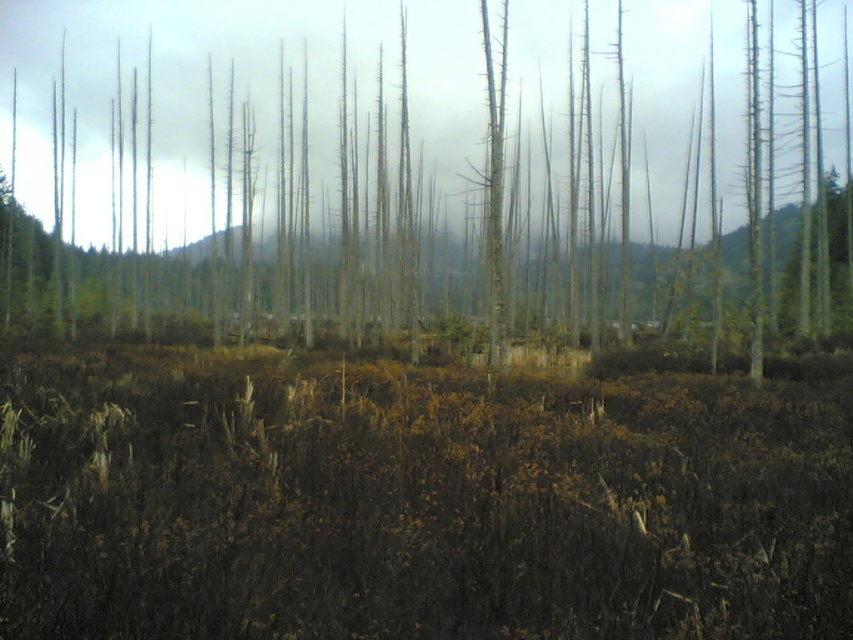
In the scene shown: Does brown dry grass at center come behind smooth gray tree trunk at center?

No.

Does brown dry grass at center have a smaller size compared to smooth gray tree trunk at center?

Correct, brown dry grass at center occupies less space than smooth gray tree trunk at center.

Between point (587, 515) and point (183, 3), which one is positioned in front?

Positioned in front is point (587, 515).

At what (x,y) coordinates should I click in order to perform the action: click on brown dry grass at center. Please return your answer as a coordinate pair (x, y). The height and width of the screenshot is (640, 853). Looking at the image, I should click on (416, 502).